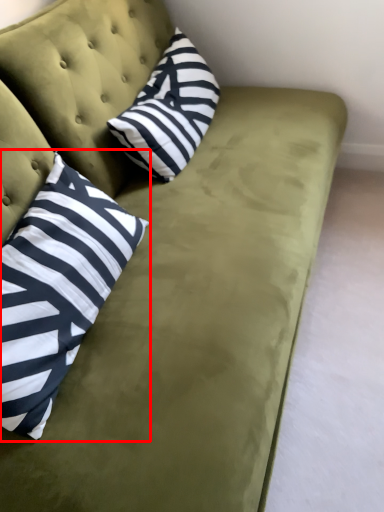
Question: Observing the image, what is the correct spatial positioning of pillow (annotated by the red box) in reference to pillow?

Choices:
 (A) right
 (B) left

Answer: (B)